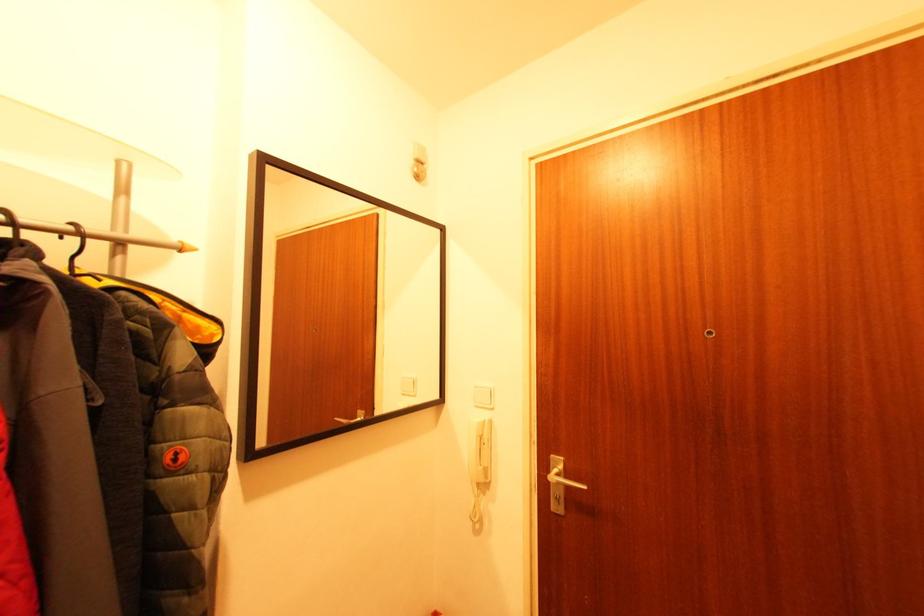
This screenshot has width=924, height=616. What do you see at coordinates (560, 484) in the screenshot?
I see `the metal door handle` at bounding box center [560, 484].